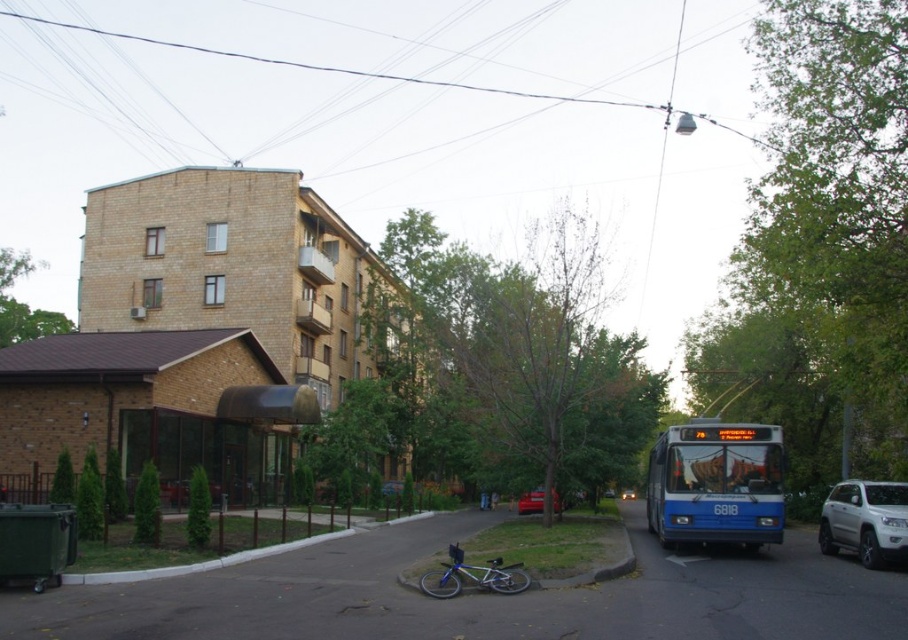
You are a city planner analyzing this street scene. You need to determine if the blue metallic bus at lower right can park under the black matte awning at center without exceeding its dimensions. Can it fit?

The blue metallic bus at lower right is larger in size than the black matte awning at center, so it cannot fit under the awning without exceeding its dimensions.

You are a pedestrian standing at the crosswalk and want to reach the entrance under the black matte awning at center. There is a blue metallic bus at lower right blocking your path. Can you walk around the bus to reach the awning?

The blue metallic bus at lower right is closer to the viewer than the black matte awning at center, so you can walk around the bus to reach the awning.